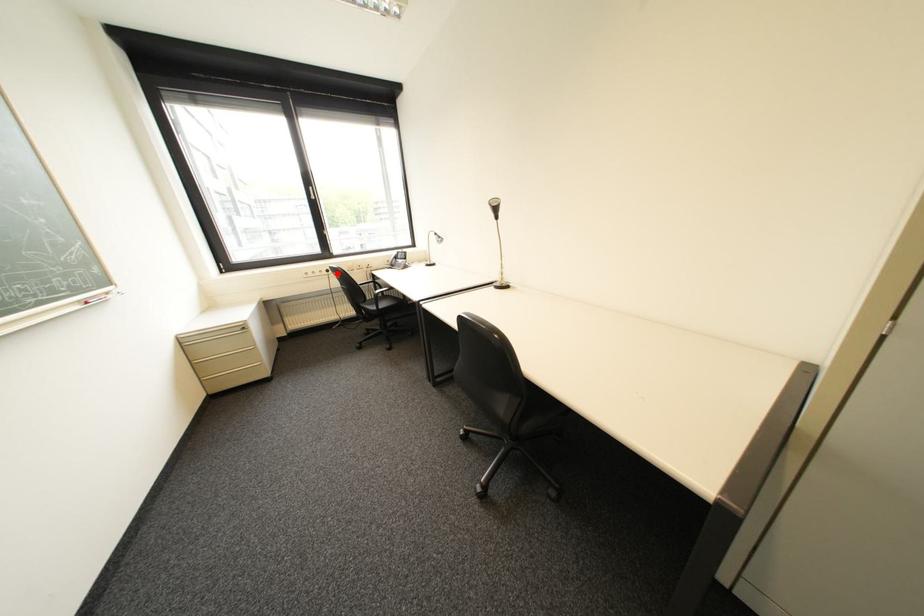
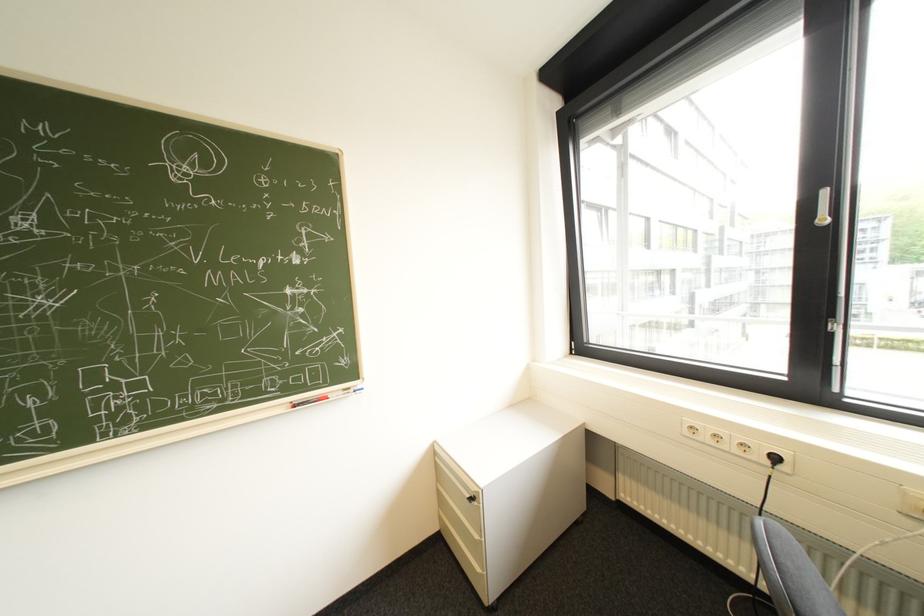
Question: I am providing you with two images of the same scene from different viewpoints. A red point is marked on the first image. Is the red point's position out of view in image 2?

Choices:
 (A) Yes
 (B) No

Answer: (B)